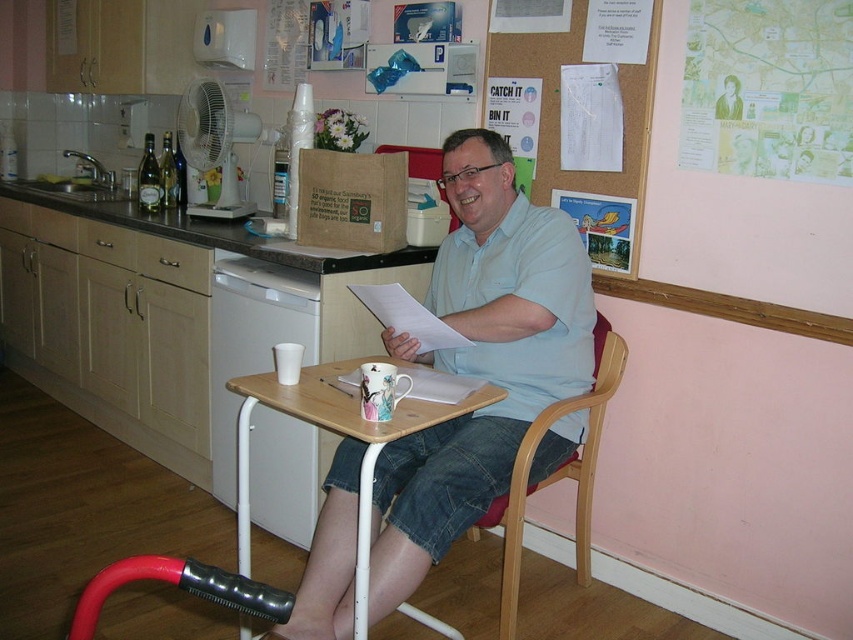
Question: Based on their relative distances, which object is farther from the wooden chair at center?

Choices:
 (A) light blue cotton shirt at center
 (B) wooden tray at center

Answer: (B)

Question: Is wooden tray at center above wooden chair at center?

Choices:
 (A) no
 (B) yes

Answer: (B)

Question: Which is farther from the corkboard at upper center?

Choices:
 (A) wooden chair at center
 (B) wooden tray at center

Answer: (B)

Question: Which of the following is the farthest from the observer?

Choices:
 (A) (569, 371)
 (B) (364, 538)
 (C) (573, 10)

Answer: (C)

Question: Can you confirm if light blue cotton shirt at center is positioned to the left of wooden tray at center?

Choices:
 (A) yes
 (B) no

Answer: (B)

Question: Does light blue cotton shirt at center appear on the left side of wooden chair at center?

Choices:
 (A) no
 (B) yes

Answer: (B)